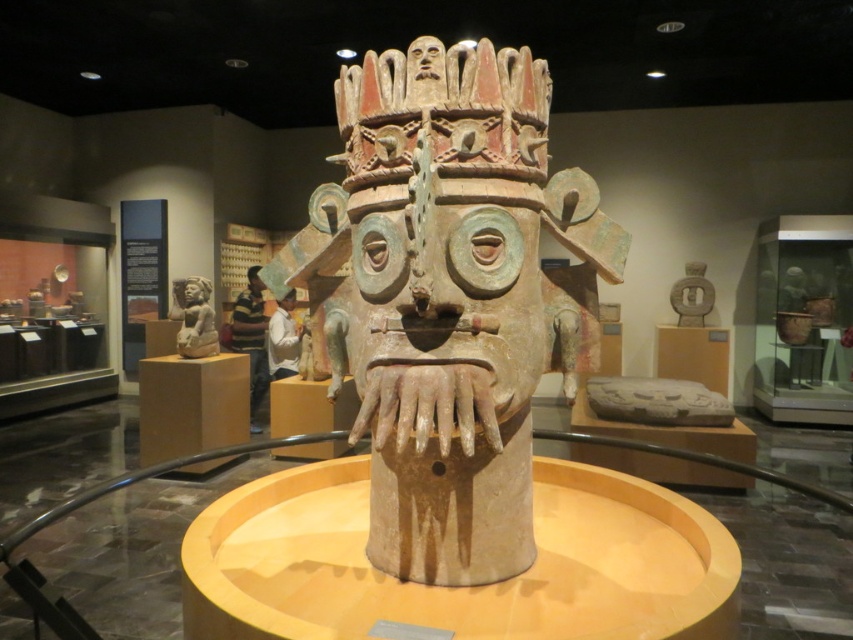
Question: Which is nearer to the striped shirt at center?

Choices:
 (A) matte brown statue at left
 (B) matte clay mask at center

Answer: (A)

Question: Can you confirm if matte brown statue at left is positioned to the right of white matte shirt at center?

Choices:
 (A) no
 (B) yes

Answer: (A)

Question: Among these points, which one is farthest from the camera?

Choices:
 (A) (253, 340)
 (B) (187, 291)

Answer: (A)

Question: Observing the image, what is the correct spatial positioning of striped shirt at center in reference to matte brown statue at left?

Choices:
 (A) above
 (B) below

Answer: (B)

Question: Does matte clay mask at center have a larger size compared to white matte shirt at center?

Choices:
 (A) no
 (B) yes

Answer: (B)

Question: Which object appears closest to the camera in this image?

Choices:
 (A) matte clay mask at center
 (B) striped shirt at center

Answer: (A)